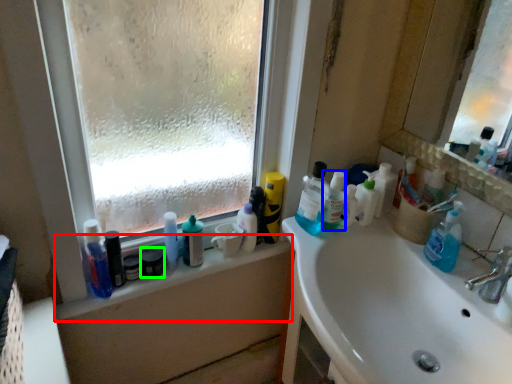
Question: Based on their relative distances, which object is farther from window sill (highlighted by a red box)? Choose from toiletry (highlighted by a blue box) and mouthwash (highlighted by a green box).

Choices:
 (A) toiletry
 (B) mouthwash

Answer: (A)